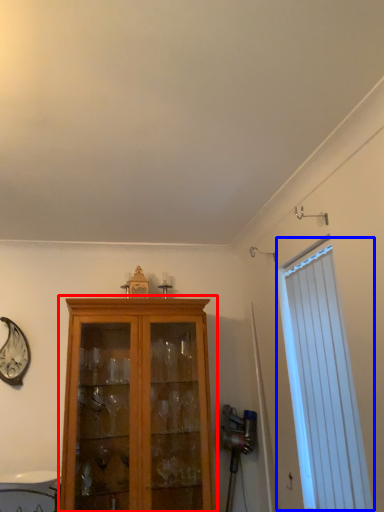
Question: Which point is closer to the camera, cupboard (highlighted by a red box) or window (highlighted by a blue box)?

Choices:
 (A) cupboard
 (B) window

Answer: (B)